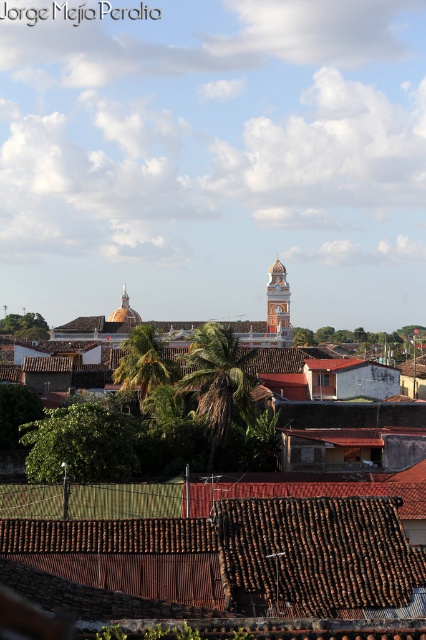
Which is more to the right, brown corrugated roof at center or orange painted stone clock tower at center?

orange painted stone clock tower at center

Does brown corrugated roof at center appear under orange painted stone clock tower at center?

Indeed, brown corrugated roof at center is positioned under orange painted stone clock tower at center.

Image resolution: width=426 pixels, height=640 pixels. What do you see at coordinates (224, 560) in the screenshot?
I see `brown corrugated roof at center` at bounding box center [224, 560].

At what (x,y) coordinates should I click in order to perform the action: click on brown corrugated roof at center. Please return your answer as a coordinate pair (x, y). The image size is (426, 640). Looking at the image, I should click on (224, 560).

Which of these two, brown corrugated roof at center or brown corrugated tile roof at lower center, stands shorter?

→ brown corrugated tile roof at lower center is shorter.

Based on the photo, can you confirm if brown corrugated roof at center is positioned to the right of brown corrugated tile roof at lower center?

Correct, you'll find brown corrugated roof at center to the right of brown corrugated tile roof at lower center.

Who is more forward, (x=195, y=506) or (x=356, y=586)?

Point (x=356, y=586) is more forward.

Where is `brown corrugated roof at center`? brown corrugated roof at center is located at coordinates (224, 560).

Is the position of brown corrugated tile roof at lower center less distant than that of orange painted stone clock tower at center?

Yes, it is.

Consider the image. Between brown corrugated tile roof at lower center and orange painted stone clock tower at center, which one is positioned higher?

orange painted stone clock tower at center is above.

Is point (331, 561) behind point (271, 276)?

No, (331, 561) is closer to viewer.

The height and width of the screenshot is (640, 426). What are the coordinates of `brown corrugated tile roof at lower center` in the screenshot? It's located at (238, 556).